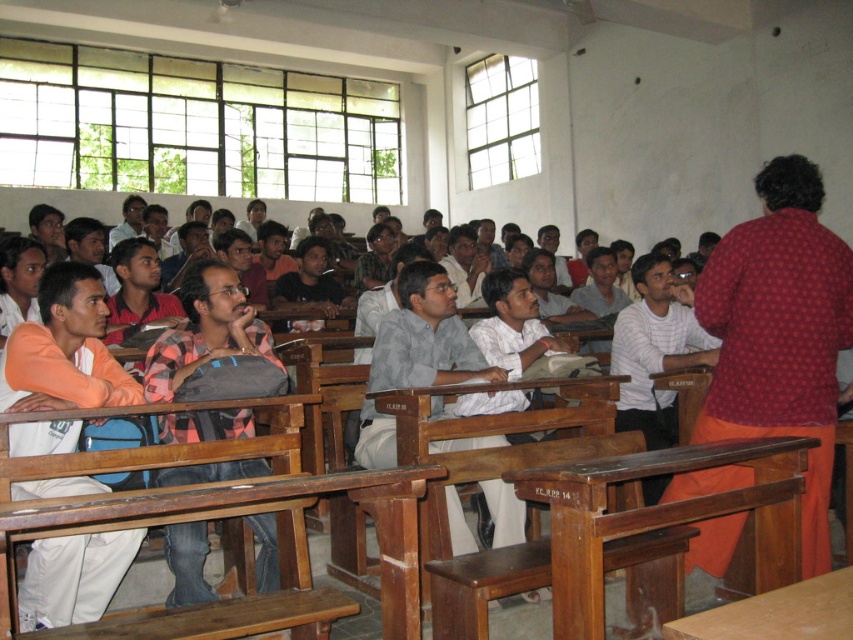
Measure the distance between brown wooden table at center and camera.

brown wooden table at center and camera are 2.76 meters apart.

Consider the image. Does brown wooden table at center have a lesser width compared to brown wood table at lower left?

Yes, brown wooden table at center is thinner than brown wood table at lower left.

Does point (589, 630) lie in front of point (138, 508)?

That is False.

Locate an element on the screen. This screenshot has width=853, height=640. brown wooden table at center is located at coordinates (622, 536).

At what (x,y) coordinates should I click in order to perform the action: click on red dotted shirt at upper right. Please return your answer as a coordinate pair (x, y). The width and height of the screenshot is (853, 640). Looking at the image, I should click on (780, 332).

Does point (817, 307) come closer to viewer compared to point (387, 588)?

No, (817, 307) is further to viewer.

This screenshot has width=853, height=640. In order to click on red dotted shirt at upper right in this screenshot , I will do (x=780, y=332).

Can you confirm if red dotted shirt at upper right is smaller than brown wooden table at center?

No.

Which is in front, point (726, 280) or point (602, 484)?

Point (602, 484) is more forward.

Who is more forward, (735, 406) or (614, 460)?

Point (614, 460) is in front.

Where is `red dotted shirt at upper right`? red dotted shirt at upper right is located at coordinates (780, 332).